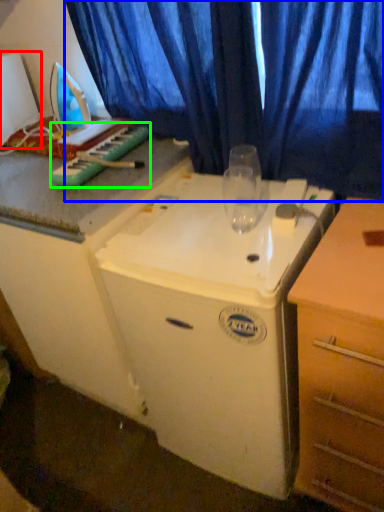
Question: Which object is positioned farthest from appliance (highlighted by a red box)? Select from curtain (highlighted by a blue box) and musical keyboard (highlighted by a green box).

Choices:
 (A) curtain
 (B) musical keyboard

Answer: (A)